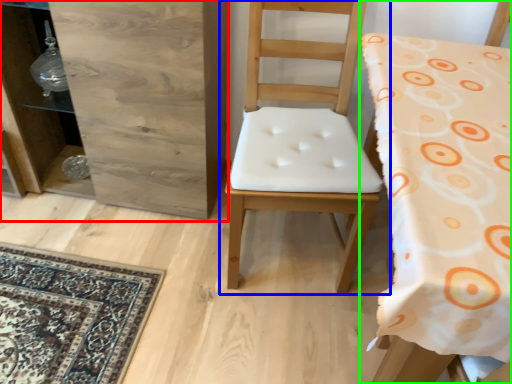
Question: Which object is the closest to the dresser (highlighted by a red box)? Choose among these: chair (highlighted by a blue box) or chair (highlighted by a green box).

Choices:
 (A) chair
 (B) chair

Answer: (A)